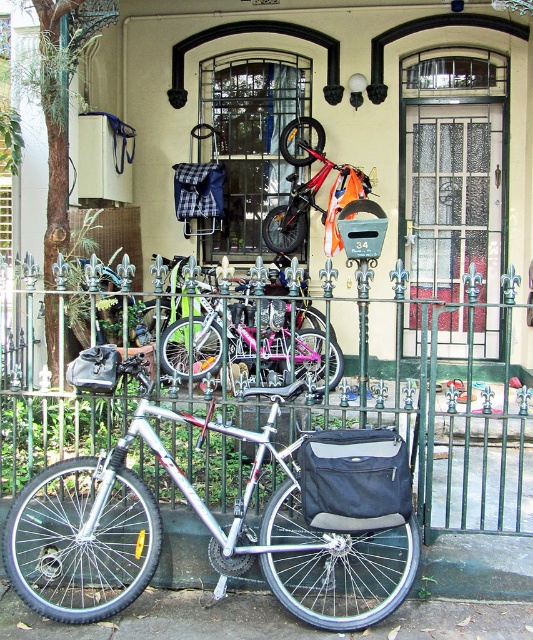
Question: Which of these objects is positioned farthest from the pink metallic bicycle at center?

Choices:
 (A) orange matte bicycle at center
 (B) green wrought iron fence at center

Answer: (B)

Question: Considering the real-world distances, which object is closest to the green wrought iron fence at center?

Choices:
 (A) silver metallic bicycle at center
 (B) pink metallic bicycle at center
 (C) orange matte bicycle at center

Answer: (A)

Question: Which of the following is the farthest from the observer?

Choices:
 (A) (222, 432)
 (B) (361, 536)
 (C) (326, 164)
 (D) (269, 314)

Answer: (C)

Question: Can you confirm if pink metallic bicycle at center is positioned to the left of orange matte bicycle at center?

Choices:
 (A) yes
 (B) no

Answer: (A)

Question: Where is green wrought iron fence at center located in relation to orange matte bicycle at center in the image?

Choices:
 (A) above
 (B) below

Answer: (B)

Question: Considering the relative positions of green wrought iron fence at center and orange matte bicycle at center in the image provided, where is green wrought iron fence at center located with respect to orange matte bicycle at center?

Choices:
 (A) left
 (B) right

Answer: (A)